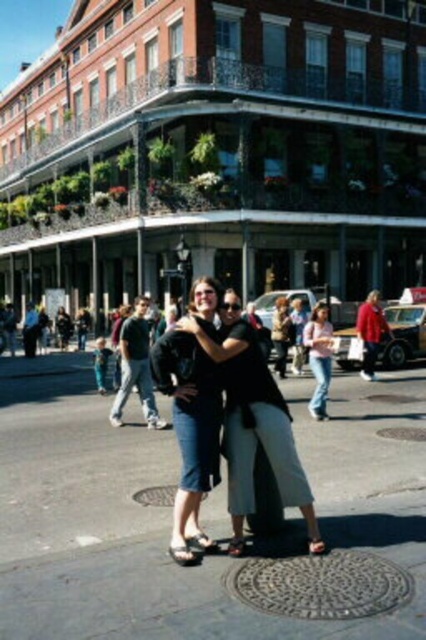
Is black fabric couple at center behind dark gray jeans at center?

No, black fabric couple at center is closer to the viewer.

Describe the element at coordinates (195, 406) in the screenshot. I see `black fabric couple at center` at that location.

Is point (238, 541) positioned before point (144, 332)?

Yes, it is.

Find the location of `black fabric couple at center`. black fabric couple at center is located at coordinates click(x=195, y=406).

The height and width of the screenshot is (640, 426). Find the location of `black fabric couple at center`. black fabric couple at center is located at coordinates (195, 406).

Is point (189, 381) positioned behind point (322, 330)?

No, (189, 381) is closer to viewer.

This screenshot has width=426, height=640. I want to click on black fabric couple at center, so click(195, 406).

Who is more distant from viewer, (x=201, y=301) or (x=141, y=339)?

The point (x=141, y=339) is more distant.

The width and height of the screenshot is (426, 640). I want to click on denim pants at center, so (189, 433).

Describe the element at coordinates (189, 433) in the screenshot. I see `denim pants at center` at that location.

The height and width of the screenshot is (640, 426). Find the location of `denim pants at center`. denim pants at center is located at coordinates (189, 433).